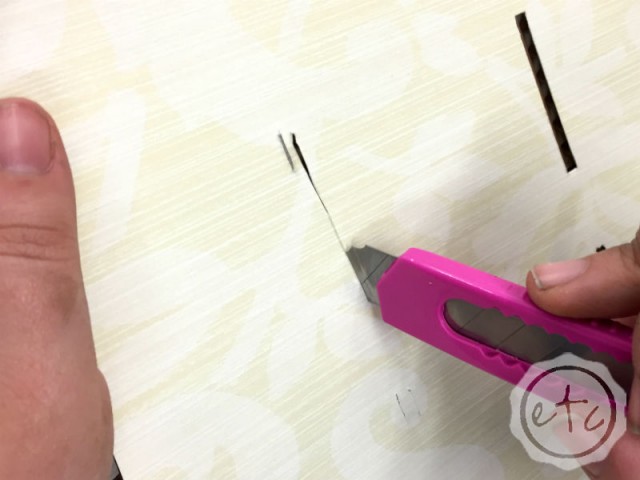
You are a GUI agent. You are given a task and a screenshot of the screen. Output one action in this format:
    pyautogui.click(x=<x>, y=<y>)
    Task: Click on the wooden board
    The width and height of the screenshot is (640, 480).
    Given the screenshot: What is the action you would take?
    pyautogui.click(x=242, y=148)